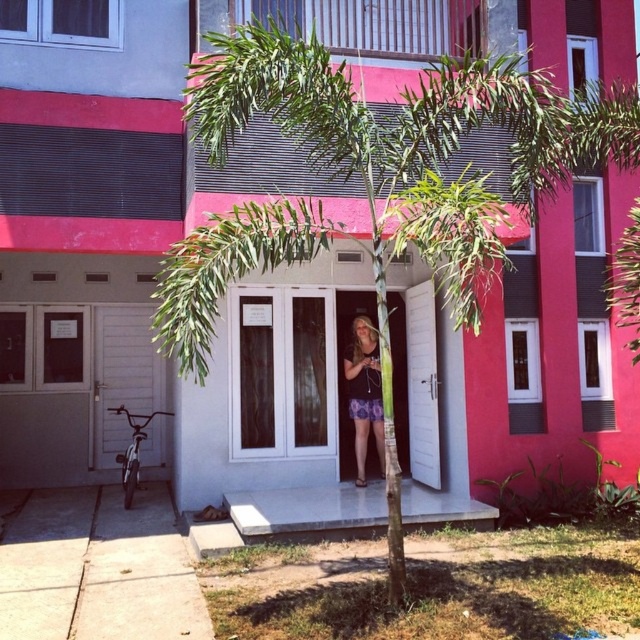
Can you confirm if green leafy palm tree at center is wider than floral skirt at center?

Indeed, green leafy palm tree at center has a greater width compared to floral skirt at center.

Can you confirm if green leafy palm tree at center is thinner than floral skirt at center?

Incorrect, green leafy palm tree at center's width is not less than floral skirt at center's.

Where is `green leafy palm tree at center`? green leafy palm tree at center is located at coordinates (394, 166).